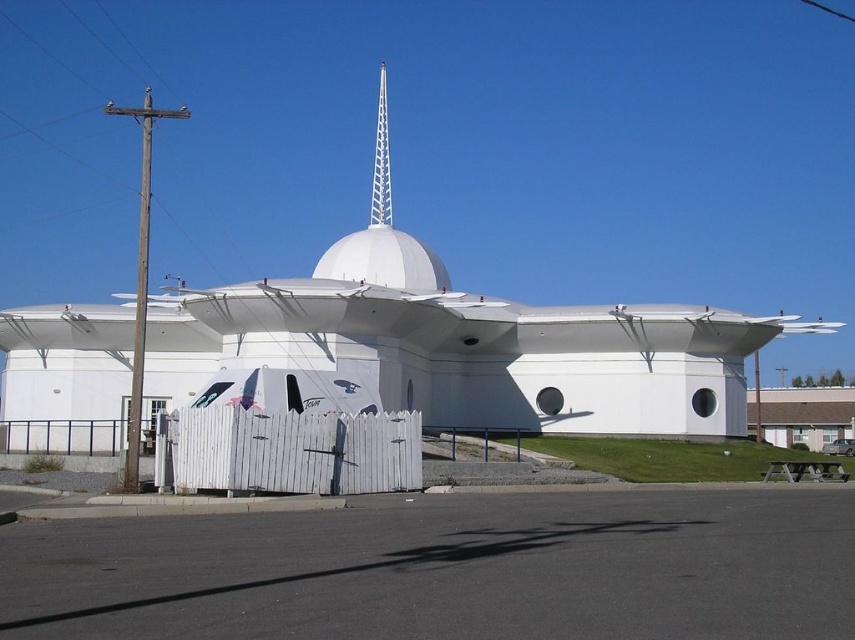
Question: Is white picket fence at lower center to the left of white lattice spire at center from the viewer's perspective?

Choices:
 (A) yes
 (B) no

Answer: (B)

Question: Which of the following is the farthest from the observer?

Choices:
 (A) white picket fence at lower center
 (B) white lattice spire at center

Answer: (B)

Question: Does white picket fence at lower center have a lesser width compared to white lattice spire at center?

Choices:
 (A) yes
 (B) no

Answer: (B)

Question: Can you confirm if white picket fence at lower center is thinner than white lattice spire at center?

Choices:
 (A) yes
 (B) no

Answer: (B)

Question: Among these points, which one is nearest to the camera?

Choices:
 (A) (276, 476)
 (B) (388, 182)

Answer: (A)

Question: Which of the following is the farthest from the observer?

Choices:
 (A) white picket fence at lower center
 (B) white lattice spire at center

Answer: (B)